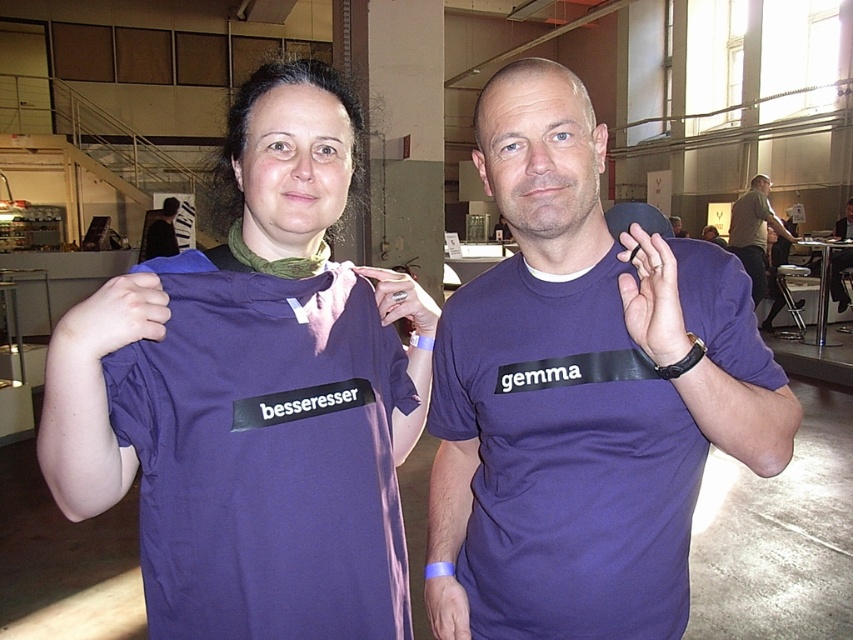
Question: Which of the following is the farthest from the observer?

Choices:
 (A) green fabric at center
 (B) matte black t-shirt at upper left

Answer: (B)

Question: Where is purple matte t-shirt at center located in relation to matte purple shirt at center in the image?

Choices:
 (A) left
 (B) right

Answer: (A)

Question: Can you confirm if matte black t-shirt at upper left is positioned below matte purple shirt at center?

Choices:
 (A) yes
 (B) no

Answer: (A)

Question: Which point appears closest to the camera in this image?

Choices:
 (A) (358, 602)
 (B) (599, 205)

Answer: (A)

Question: Which point appears closest to the camera in this image?

Choices:
 (A) (241, 580)
 (B) (144, 241)
 (C) (312, 240)
 (D) (519, 620)

Answer: (A)

Question: Is matte purple t-shirt at center smaller than green fabric at center?

Choices:
 (A) yes
 (B) no

Answer: (B)